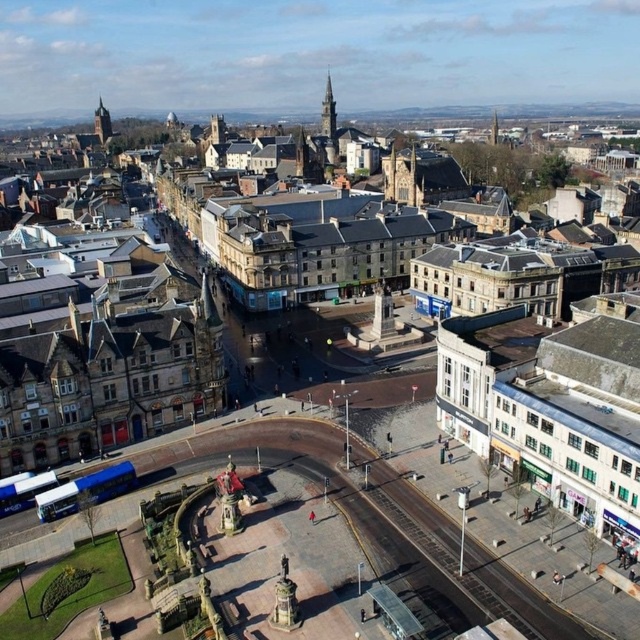
Question: Is brown stone town at center to the right of dark brown stone tower at upper left from the viewer's perspective?

Choices:
 (A) no
 (B) yes

Answer: (B)

Question: Which of the following is the closest to the observer?

Choices:
 (A) smooth stone tower at upper center
 (B) brown stone town at center
 (C) dark brown stone tower at upper left

Answer: (B)

Question: Among these objects, which one is nearest to the camera?

Choices:
 (A) brown stone town at center
 (B) dark brown stone tower at upper left

Answer: (A)

Question: Among these objects, which one is farthest from the camera?

Choices:
 (A) brown stone town at center
 (B) dark brown stone tower at upper left
 (C) smooth stone tower at upper center

Answer: (B)

Question: In this image, where is brown stone town at center located relative to dark brown stone tower at upper left?

Choices:
 (A) below
 (B) above

Answer: (A)

Question: Is smooth stone tower at upper center to the right of dark brown stone tower at upper left from the viewer's perspective?

Choices:
 (A) no
 (B) yes

Answer: (B)